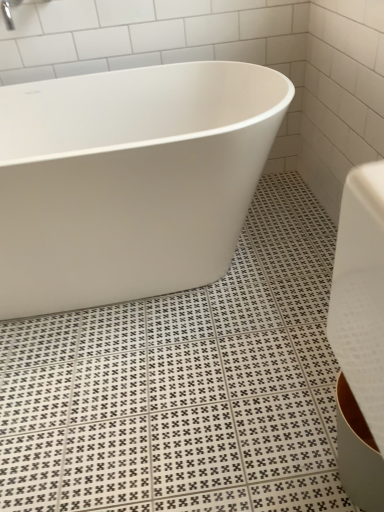
The width and height of the screenshot is (384, 512). Describe the element at coordinates (129, 180) in the screenshot. I see `white glossy bathtub at center` at that location.

Locate an element on the screen. The height and width of the screenshot is (512, 384). white glossy bathtub at center is located at coordinates (129, 180).

What is the approximate width of white glossy bathtub at center?

The width of white glossy bathtub at center is 28.47 inches.

Where is `silver metallic faucet at upper left`? The width and height of the screenshot is (384, 512). silver metallic faucet at upper left is located at coordinates (14, 7).

This screenshot has height=512, width=384. What do you see at coordinates (14, 7) in the screenshot?
I see `silver metallic faucet at upper left` at bounding box center [14, 7].

What is the approximate height of silver metallic faucet at upper left?

silver metallic faucet at upper left is 5.47 inches tall.

In order to face silver metallic faucet at upper left, should I rotate leftwards or rightwards?

Rotate your view left by about 23.137°.

The width and height of the screenshot is (384, 512). Find the location of `white glossy bathtub at center`. white glossy bathtub at center is located at coordinates (129, 180).

Between silver metallic faucet at upper left and white glossy bathtub at center, which one appears on the right side from the viewer's perspective?

From the viewer's perspective, white glossy bathtub at center appears more on the right side.

Is silver metallic faucet at upper left positioned in front of white glossy bathtub at center?

No, silver metallic faucet at upper left is behind white glossy bathtub at center.

Does point (8, 1) lie in front of point (158, 231)?

No, (8, 1) is further to viewer.

From the image's perspective, is silver metallic faucet at upper left below white glossy bathtub at center?

No, from the image's perspective, silver metallic faucet at upper left is not below white glossy bathtub at center.

From a real-world perspective, is silver metallic faucet at upper left positioned over white glossy bathtub at center based on gravity?

Yes, from a real-world perspective, silver metallic faucet at upper left is over white glossy bathtub at center

Does silver metallic faucet at upper left have a lesser width compared to white glossy bathtub at center?

Yes, silver metallic faucet at upper left is thinner than white glossy bathtub at center.

From the picture: Considering the relative sizes of silver metallic faucet at upper left and white glossy bathtub at center in the image provided, is silver metallic faucet at upper left shorter than white glossy bathtub at center?

Yes.

Between silver metallic faucet at upper left and white glossy bathtub at center, which one has smaller size?

With smaller size is silver metallic faucet at upper left.

Would you say silver metallic faucet at upper left contains white glossy bathtub at center?

Definitely not — white glossy bathtub at center is not inside silver metallic faucet at upper left.

Is silver metallic faucet at upper left next to white glossy bathtub at center?

No, silver metallic faucet at upper left is not beside white glossy bathtub at center.

Does silver metallic faucet at upper left turn towards white glossy bathtub at center?

No, silver metallic faucet at upper left is not facing towards white glossy bathtub at center.

How many degrees apart are the facing directions of silver metallic faucet at upper left and white glossy bathtub at center?

The angular difference between silver metallic faucet at upper left and white glossy bathtub at center is 0.916 degrees.

This screenshot has width=384, height=512. I want to click on faucet behind the white glossy bathtub at center, so click(x=14, y=7).

Considering the relative positions of white glossy bathtub at center and silver metallic faucet at upper left in the image provided, is white glossy bathtub at center to the left or to the right of silver metallic faucet at upper left?

white glossy bathtub at center is to the right of silver metallic faucet at upper left.

Considering the positions of objects white glossy bathtub at center and silver metallic faucet at upper left in the image provided, who is in front, white glossy bathtub at center or silver metallic faucet at upper left?

white glossy bathtub at center is closer to the camera.

Which is behind, point (227, 167) or point (10, 13)?

The point (10, 13) is more distant.

Consider the image. From the image's perspective, relative to silver metallic faucet at upper left, is white glossy bathtub at center above or below?

Clearly, from the image's perspective, white glossy bathtub at center is below silver metallic faucet at upper left.

Looking at this image, from a real-world perspective, is white glossy bathtub at center positioned above or below silver metallic faucet at upper left?

From a real-world perspective, white glossy bathtub at center is physically below silver metallic faucet at upper left.

Does white glossy bathtub at center have a greater width compared to silver metallic faucet at upper left?

Indeed, white glossy bathtub at center has a greater width compared to silver metallic faucet at upper left.

Which of these two, white glossy bathtub at center or silver metallic faucet at upper left, stands taller?

Standing taller between the two is white glossy bathtub at center.

Between white glossy bathtub at center and silver metallic faucet at upper left, which one has smaller size?

Smaller between the two is silver metallic faucet at upper left.

Would you say white glossy bathtub at center contains silver metallic faucet at upper left?

No, silver metallic faucet at upper left is not a part of white glossy bathtub at center.

Is white glossy bathtub at center far from silver metallic faucet at upper left?

No, white glossy bathtub at center is in close proximity to silver metallic faucet at upper left.

Is white glossy bathtub at center turned away from silver metallic faucet at upper left?

white glossy bathtub at center does not have its back to silver metallic faucet at upper left.

How different are the orientations of white glossy bathtub at center and silver metallic faucet at upper left in degrees?

They differ by 0.916 degrees in their facing directions.

How much distance is there between white glossy bathtub at center and silver metallic faucet at upper left?

The distance of white glossy bathtub at center from silver metallic faucet at upper left is 72.58 centimeters.

There is a white glossy bathtub at center. Where is `faucet above it (from a real-world perspective)`? The image size is (384, 512). faucet above it (from a real-world perspective) is located at coordinates (14, 7).

The height and width of the screenshot is (512, 384). What are the coordinates of `bathtub on the right of silver metallic faucet at upper left` in the screenshot? It's located at pyautogui.click(x=129, y=180).

At what (x,y) coordinates should I click in order to perform the action: click on bathtub below the silver metallic faucet at upper left (from a real-world perspective). Please return your answer as a coordinate pair (x, y). Image resolution: width=384 pixels, height=512 pixels. Looking at the image, I should click on (129, 180).